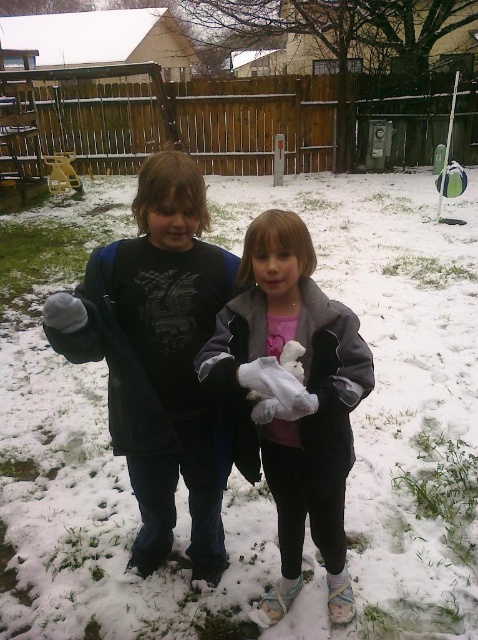
You are a parent trying to locate where your child left their mittens in the snowy backyard. The coordinates given are for the exact spot where the mittens were last seen. Based on the scene description, what is located at the coordinates point (392, 396)?

The coordinates point (392, 396) corresponds to white fluffy snow at center, so the mittens are located at the white fluffy snow at center.

You are a child playing in the snowy backyard. You see the white fluffy snow at center and the white fluffy stuffed animal at center. Which one is higher up?

The white fluffy snow at center is located above the white fluffy stuffed animal at center, so the snow is higher up.